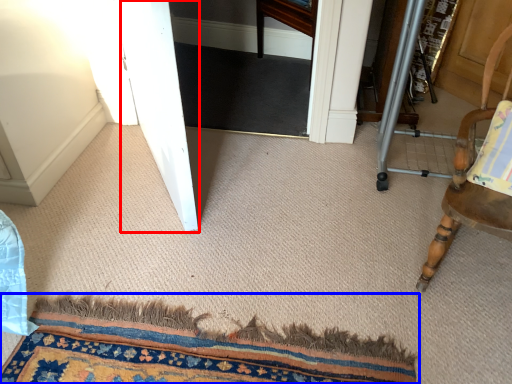
Question: Which point is further to the camera, screen door (highlighted by a red box) or mat (highlighted by a blue box)?

Choices:
 (A) screen door
 (B) mat

Answer: (A)